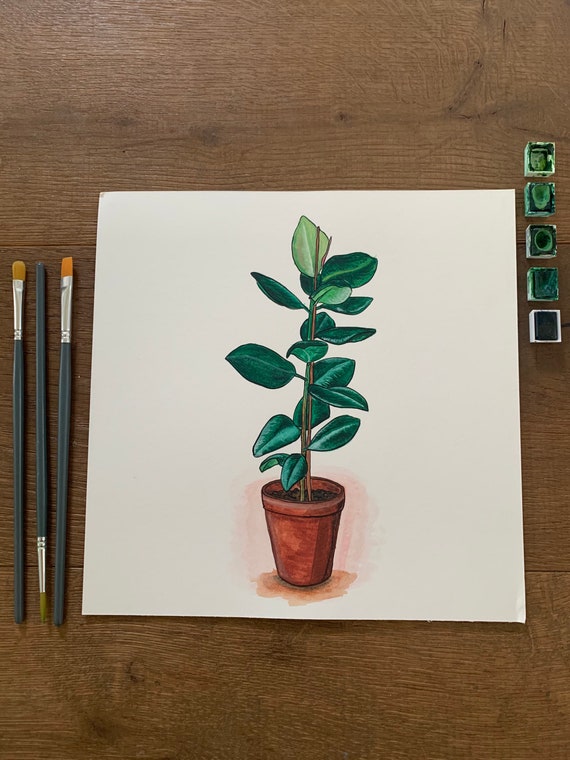
Where is `table`? table is located at coordinates (388, 689).